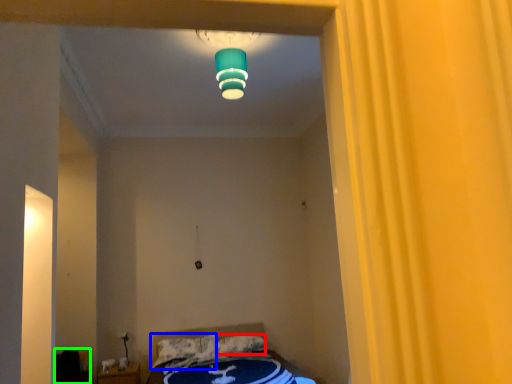
Question: Which object is the closest to the pillow (highlighted by a red box)? Choose among these: pillow (highlighted by a blue box) or furniture (highlighted by a green box).

Choices:
 (A) pillow
 (B) furniture

Answer: (A)